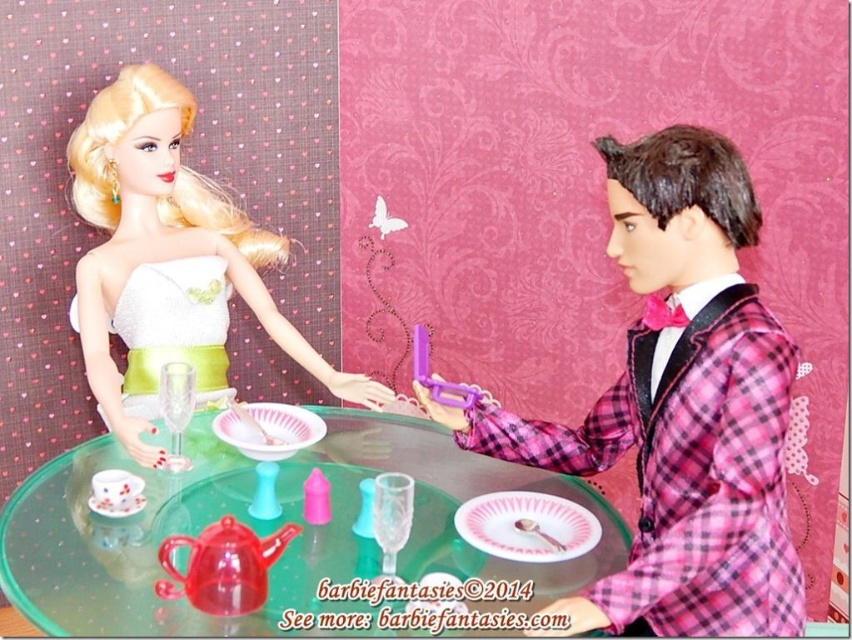
Question: Which object appears farthest from the camera in this image?

Choices:
 (A) transparent glass table at center
 (B) matte white dress at upper left
 (C) white satin dress at upper left

Answer: (C)

Question: Is matte white dress at upper left above transparent glass table at center?

Choices:
 (A) yes
 (B) no

Answer: (A)

Question: Is transparent glass table at center wider than white satin dress at upper left?

Choices:
 (A) no
 (B) yes

Answer: (B)

Question: Which of these objects is positioned farthest from the matte white dress at upper left?

Choices:
 (A) transparent glass table at center
 (B) white satin dress at upper left

Answer: (B)

Question: From the image, what is the correct spatial relationship of matte white dress at upper left in relation to transparent glass table at center?

Choices:
 (A) above
 (B) below

Answer: (A)

Question: Among these points, which one is farthest from the camera?

Choices:
 (A) (678, 625)
 (B) (348, 413)
 (C) (82, 307)

Answer: (B)